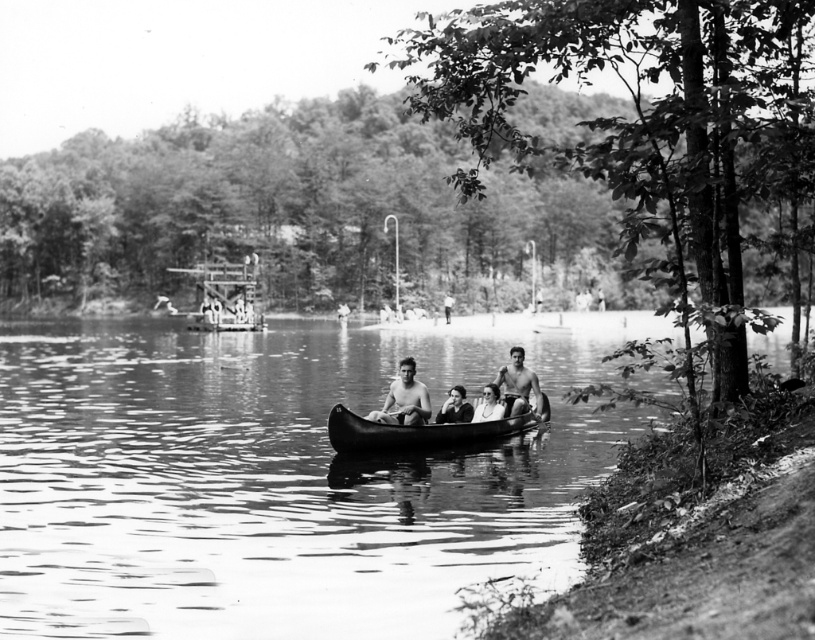
Question: Can you confirm if shiny silver canoe at center is positioned above smooth skin face at center?

Choices:
 (A) yes
 (B) no

Answer: (A)

Question: Which point appears closest to the camera in this image?

Choices:
 (A) (518, 365)
 (B) (456, 444)

Answer: (B)

Question: Which is nearer to the smooth skin face at center?

Choices:
 (A) smooth wooden canoe at center
 (B) shiny silver canoe at center
 (C) smooth water at center

Answer: (B)

Question: Can you confirm if smooth wood canoe at center is bigger than shiny silver canoe at center?

Choices:
 (A) yes
 (B) no

Answer: (A)

Question: Which point is farther from the camera taking this photo?

Choices:
 (A) (346, 486)
 (B) (355, 451)

Answer: (B)

Question: Where is smooth wood canoe at center located in relation to shiny silver canoe at center in the image?

Choices:
 (A) below
 (B) above

Answer: (A)